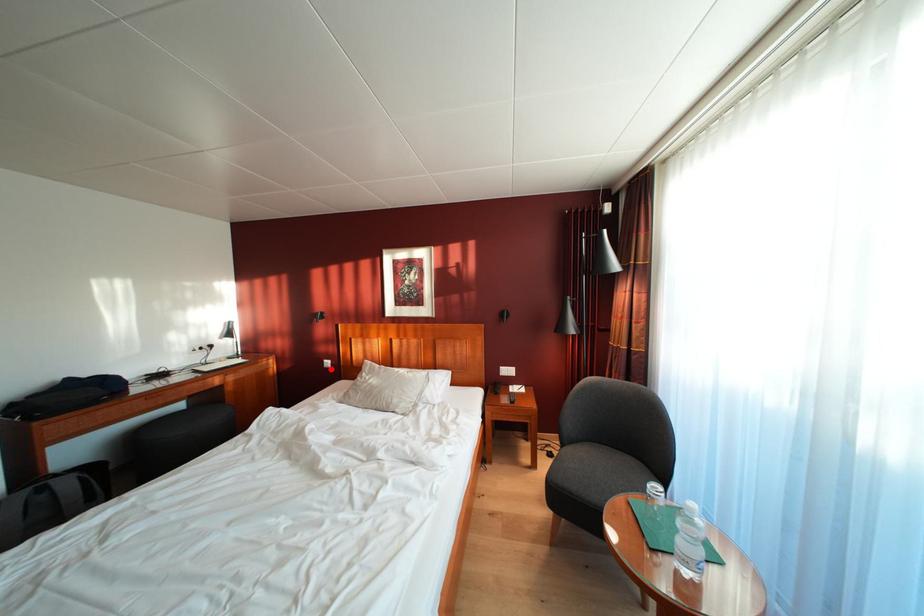
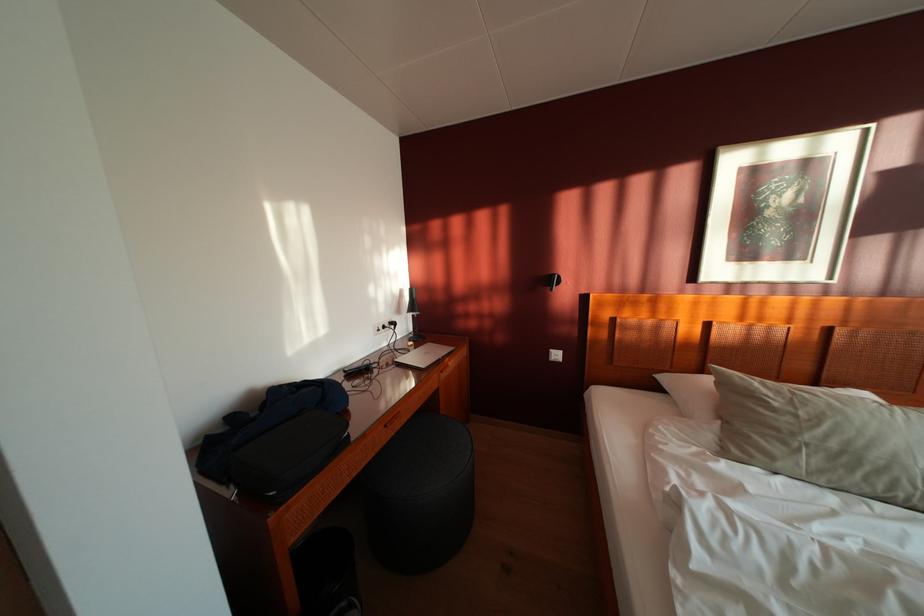
Question: A red point is marked in image1. In image2, is the corresponding 3D point closer to the camera or farther? Reply with the corresponding letter.

Choices:
 (A) The corresponding 3D point is closer.
 (B) The corresponding 3D point is farther.

Answer: (A)